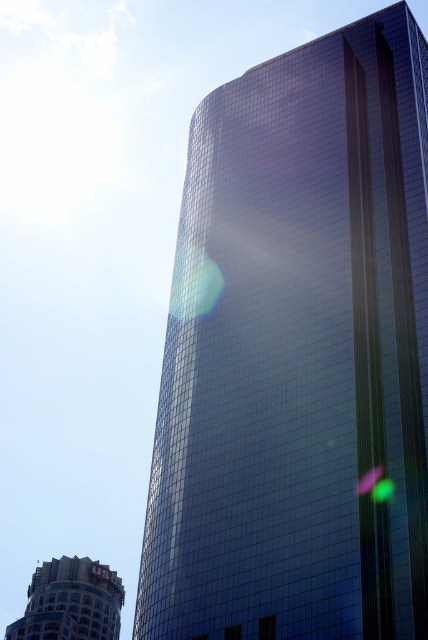
Who is shorter, glossy glass tower at center or matte silver building at lower left?

matte silver building at lower left

Who is more distant from viewer, (214, 570) or (29, 616)?

The point (29, 616) is behind.

The image size is (428, 640). In order to click on glossy glass tower at center in this screenshot , I will do `click(297, 353)`.

Find the location of a particular element. The width and height of the screenshot is (428, 640). glossy glass tower at center is located at coordinates (297, 353).